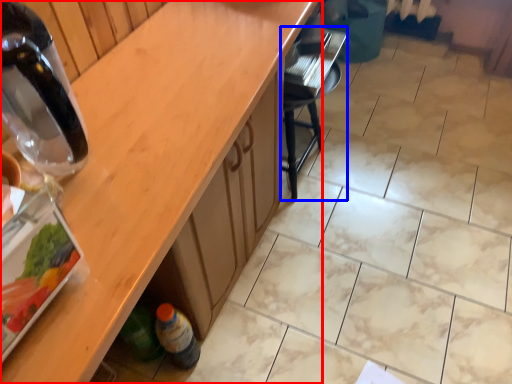
Question: Which object is further to the camera taking this photo, countertop (highlighted by a red box) or chair (highlighted by a blue box)?

Choices:
 (A) countertop
 (B) chair

Answer: (B)